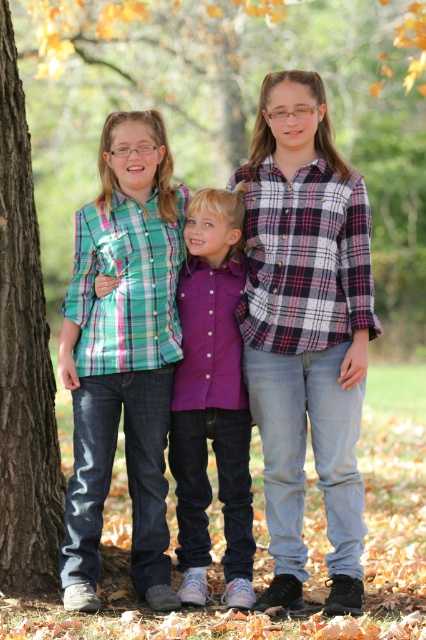
Which is above, plaid flannel shirt at center or purple cotton shirt at center?

plaid flannel shirt at center is higher up.

Is plaid flannel shirt at center taller than purple cotton shirt at center?

Yes.

Is point (302, 154) in front of point (216, 241)?

Yes, it is.

This screenshot has width=426, height=640. What are the coordinates of `plaid flannel shirt at center` in the screenshot? It's located at (305, 330).

Is plaid flannel shirt at center bigger than brown rough bark at left?

Indeed, plaid flannel shirt at center has a larger size compared to brown rough bark at left.

Does plaid flannel shirt at center have a lesser height compared to brown rough bark at left?

Yes, plaid flannel shirt at center is shorter than brown rough bark at left.

Which is in front, point (310, 209) or point (19, 476)?

Point (310, 209) is in front.

Find the location of a particular element. plaid flannel shirt at center is located at coordinates (305, 330).

Which is above, plaid shirt at center or matte plaid shirt at left?

plaid shirt at center

Where is `plaid shirt at center`? plaid shirt at center is located at coordinates (305, 330).